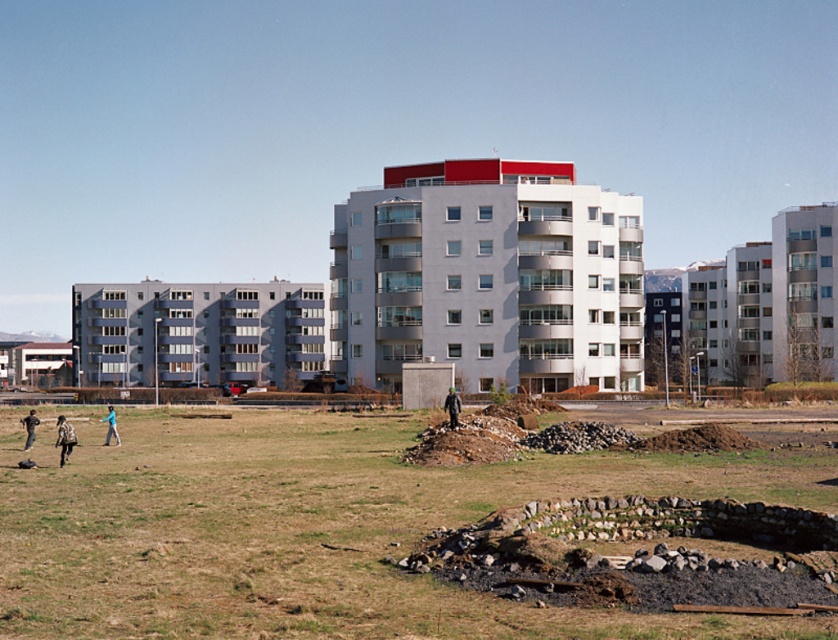
You are a delivery person who needs to place a package between the dark gray jacket at lower left and the green fabric jacket at lower left. Can you fit the package there?

The dark gray jacket at lower left is to the left of the green fabric jacket at lower left, so there is space between them to place the package.

Consider the image. You are a delivery person trying to navigate through the urban landscape shown. You need to deliver a package to the central building with the red roof. As you approach, you notice the brown grass at center and the green fabric jacket at lower left. Which object should you avoid stepping on to ensure the package remains clean?

You should avoid stepping on the brown grass at center because it is in front of the green fabric jacket at lower left, meaning it is closer to your path and the debris might be present there.